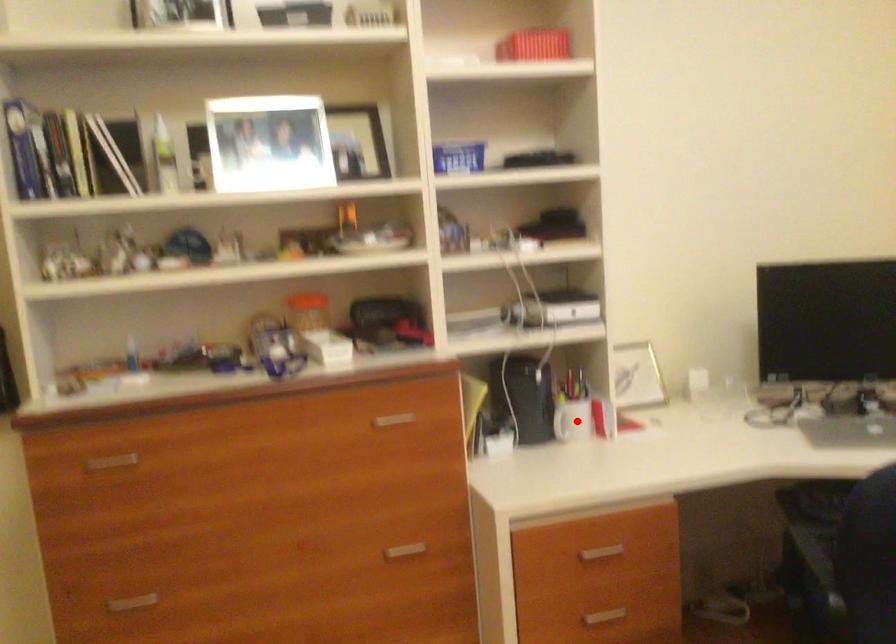
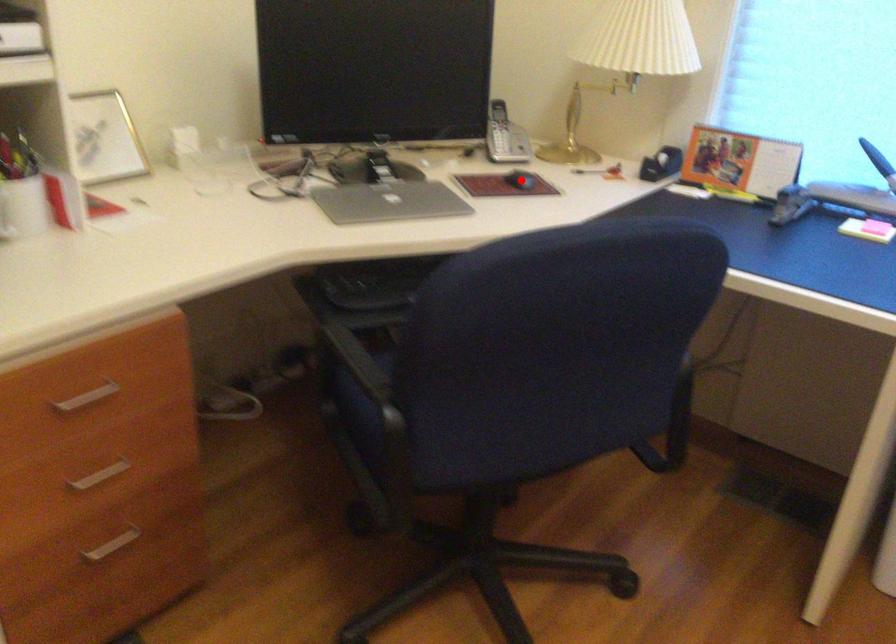
I am providing you with two images of the same scene from different viewpoints. A red point is marked on the first image and another point is marked on the second image. Does the point marked in image1 correspond to the same location as the one in image2?

No